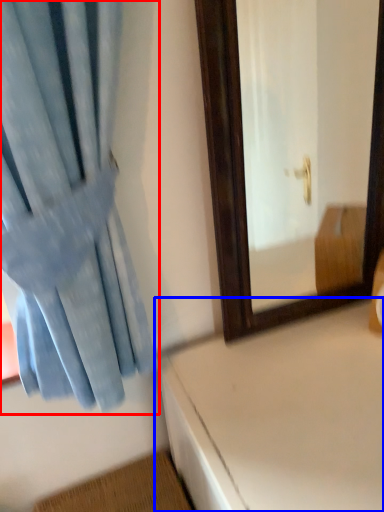
Question: Which of the following is the closest to the observer, curtain (highlighted by a red box) or table (highlighted by a blue box)?

Choices:
 (A) curtain
 (B) table

Answer: (A)